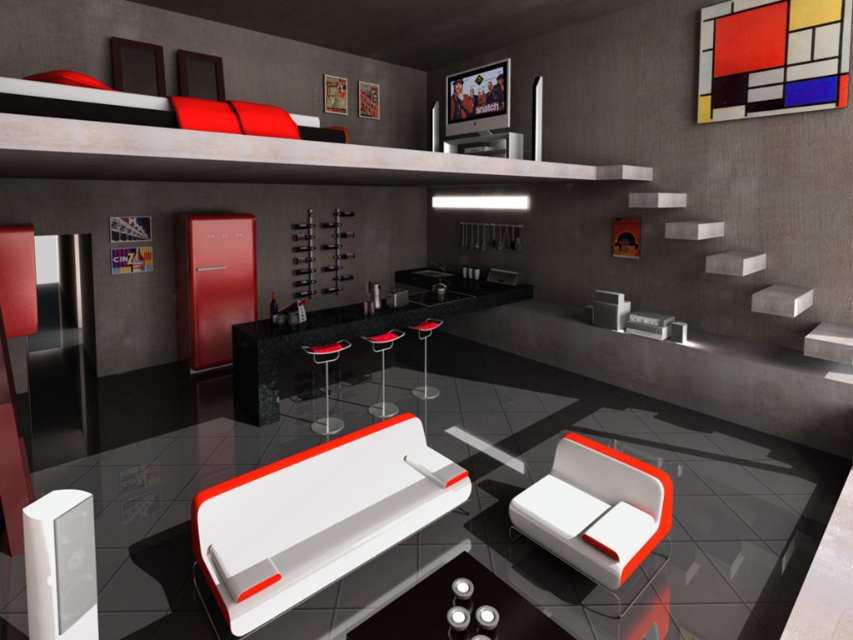
Question: Which object is the closest to the transparent plastic stool at center?

Choices:
 (A) red matte painting at upper right
 (B) red leather stool at center
 (C) white matte couch at center

Answer: (B)

Question: Is white matte couch at lower right smaller than matte black stool at center?

Choices:
 (A) yes
 (B) no

Answer: (B)

Question: Considering the real-world distances, which object is closest to the matte black stool at center?

Choices:
 (A) transparent plastic stool at center
 (B) red matte painting at upper right

Answer: (A)

Question: Is red matte painting at upper right in front of white matte couch at lower right?

Choices:
 (A) yes
 (B) no

Answer: (B)

Question: Considering the real-world distances, which object is farthest from the concrete stairs at upper right?

Choices:
 (A) red matte painting at upper right
 (B) white matte couch at center
 (C) matte black stool at center

Answer: (B)

Question: In this image, where is concrete stairs at upper right located relative to red leather stool at center?

Choices:
 (A) above
 (B) below

Answer: (A)